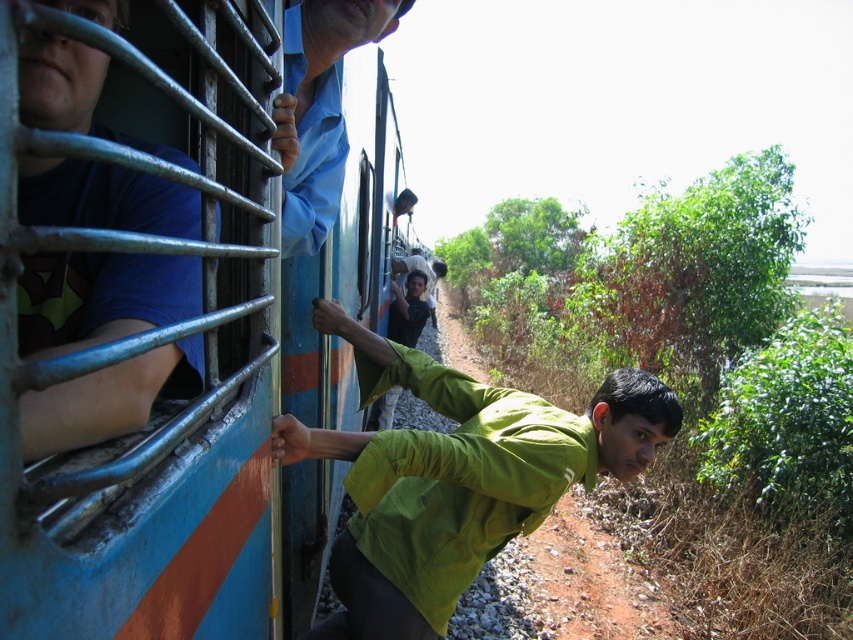
Question: Estimate the real-world distances between objects in this image. Which object is closer to the green matte shirt at center?

Choices:
 (A) blue fabric shirt at left
 (B) blue painted metal train at left

Answer: (B)

Question: Which object appears farthest from the camera in this image?

Choices:
 (A) green matte shirt at center
 (B) blue fabric shirt at left
 (C) matte green shirt at center

Answer: (C)

Question: Which of the following is the closest to the observer?

Choices:
 (A) green matte shirt at center
 (B) blue painted metal train at left

Answer: (B)

Question: Does blue fabric shirt at left appear on the left side of matte green shirt at center?

Choices:
 (A) no
 (B) yes

Answer: (A)

Question: Can you confirm if green matte shirt at center is positioned above matte green shirt at center?

Choices:
 (A) no
 (B) yes

Answer: (A)

Question: Can you confirm if green matte shirt at center is positioned to the left of matte green shirt at center?

Choices:
 (A) no
 (B) yes

Answer: (A)